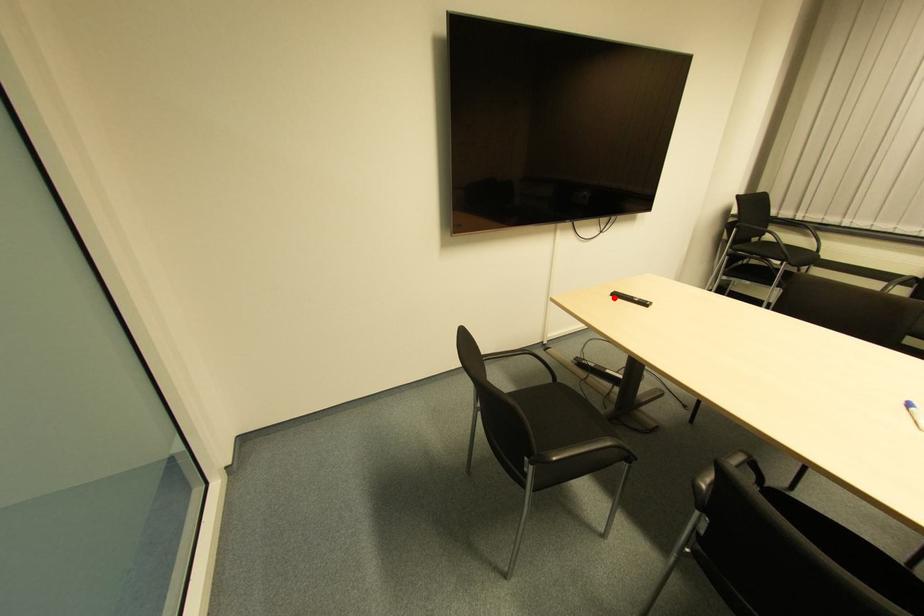
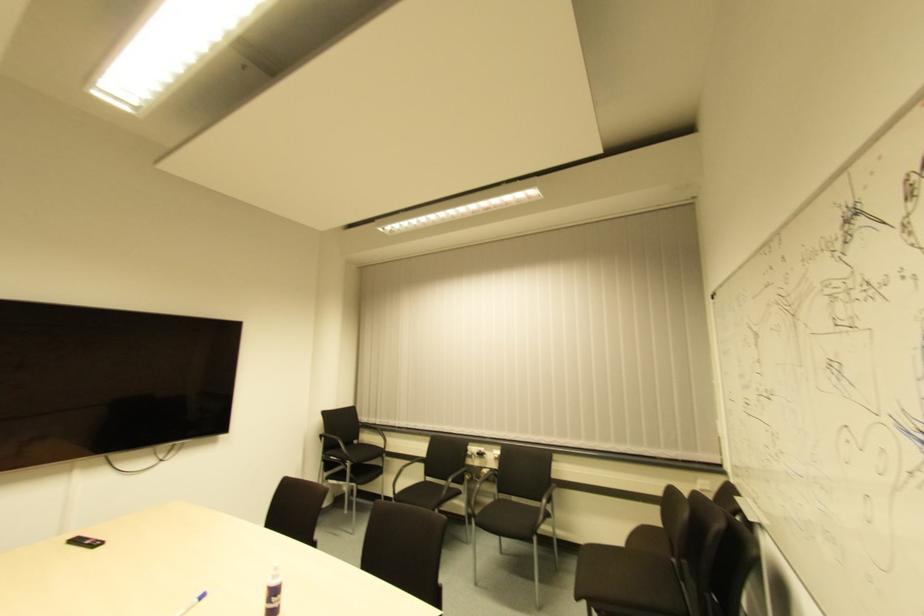
Question: I am providing you with two images of the same scene from different viewpoints. A red point is shown in image1. For the corresponding object point in image2, is it positioned nearer or farther from the camera?

Choices:
 (A) Nearer
 (B) Farther

Answer: (A)